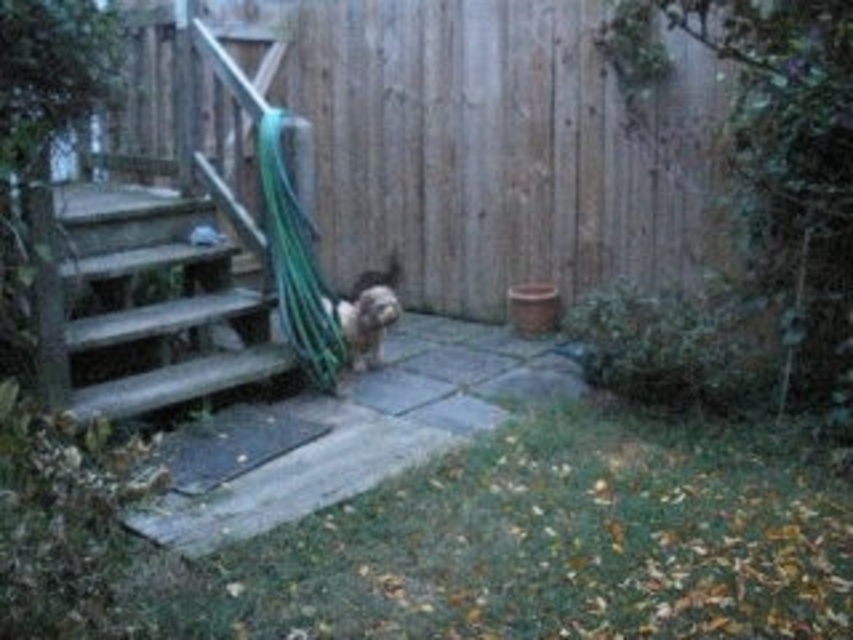
Is wooden fence at center taller than fuzzy brown dog at center?

Correct, wooden fence at center is much taller as fuzzy brown dog at center.

Is point (393, 83) farther from camera compared to point (341, 312)?

That is True.

Where is `wooden fence at center`? The height and width of the screenshot is (640, 853). wooden fence at center is located at coordinates (489, 145).

Find the location of a particular element. Image resolution: width=853 pixels, height=640 pixels. wooden fence at center is located at coordinates (489, 145).

Does wooden fence at center have a larger size compared to wooden stairs at left?

Indeed, wooden fence at center has a larger size compared to wooden stairs at left.

Is wooden fence at center further to the viewer compared to wooden stairs at left?

That is True.

I want to click on wooden fence at center, so click(489, 145).

Between wooden fence at center and green rubber hose at center, which one appears on the right side from the viewer's perspective?

From the viewer's perspective, wooden fence at center appears more on the right side.

Is wooden fence at center shorter than green rubber hose at center?

No.

Identify the location of wooden fence at center. (489, 145).